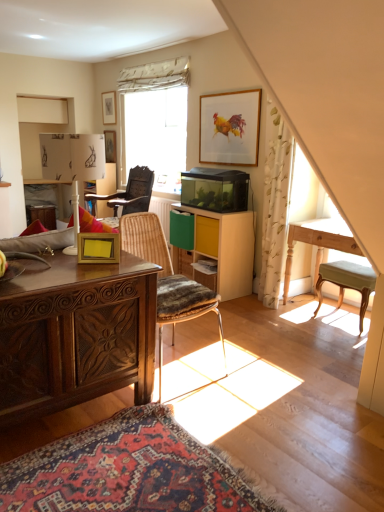
The image size is (384, 512). Describe the element at coordinates (109, 106) in the screenshot. I see `matte gold picture frame at upper center, arranged as the 3th picture frame when viewed from the right` at that location.

Describe the element at coordinates (230, 128) in the screenshot. I see `wooden picture frame at upper center, which appears as the 3th picture frame when viewed from the back` at that location.

This screenshot has height=512, width=384. What do you see at coordinates (347, 283) in the screenshot?
I see `green fabric stool at right, the 1th chair when ordered from right to left` at bounding box center [347, 283].

This screenshot has height=512, width=384. Find the location of `yellow matte cabinet at center`. yellow matte cabinet at center is located at coordinates (225, 248).

This screenshot has height=512, width=384. Describe the element at coordinates (129, 193) in the screenshot. I see `wooden armchair at center, the 3th chair positioned from the right` at that location.

Locate an element on the screen. Image resolution: width=384 pixels, height=512 pixels. polished wood desk at left is located at coordinates (76, 334).

In the scene shown: Which point is more distant from viewer, (x=112, y=143) or (x=179, y=294)?

The point (x=112, y=143) is farther.

Can you tell me how much wooden picture frame at upper center, which ranks as the first picture frame in left-to-right order, and rustic wood chair at center, arranged as the 3th chair when viewed from the back, differ in facing direction?

87.1 degrees separate the facing orientations of wooden picture frame at upper center, which ranks as the first picture frame in left-to-right order, and rustic wood chair at center, arranged as the 3th chair when viewed from the back.

Would you say wooden picture frame at upper center, which ranks as the first picture frame in left-to-right order, is to the left or to the right of rustic wood chair at center, marked as the 1th chair in a front-to-back arrangement, in the picture?

wooden picture frame at upper center, which ranks as the first picture frame in left-to-right order, is positioned on rustic wood chair at center, marked as the 1th chair in a front-to-back arrangement,'s left side.

Considering the sizes of wooden picture frame at upper center, the 1th picture frame from the back, and rustic wood chair at center, arranged as the 3th chair when viewed from the back, in the image, is wooden picture frame at upper center, the 1th picture frame from the back, wider or thinner than rustic wood chair at center, arranged as the 3th chair when viewed from the back,?

wooden picture frame at upper center, the 1th picture frame from the back, is thinner than rustic wood chair at center, arranged as the 3th chair when viewed from the back.

How distant is light wood table at right from wooden photo frame at center, which is the 4th picture frame in back-to-front order?

A distance of 1.80 meters exists between light wood table at right and wooden photo frame at center, which is the 4th picture frame in back-to-front order.

Is light wood table at right not within wooden photo frame at center, which is the third picture frame from left to right?

Yes, light wood table at right is not within wooden photo frame at center, which is the third picture frame from left to right.

Between light wood table at right and wooden photo frame at center, which is the third picture frame from left to right, which one has smaller width?

wooden photo frame at center, which is the third picture frame from left to right, is thinner.

Could you tell me if light wood table at right is facing wooden photo frame at center, which is counted as the 1th picture frame, starting from the bottom?

Yes, light wood table at right is facing wooden photo frame at center, which is counted as the 1th picture frame, starting from the bottom.

Is wooden photo frame at center, the 1th picture frame in the front-to-back sequence, facing away from rustic wood chair at center, arranged as the 3th chair when viewed from the back?

No, rustic wood chair at center, arranged as the 3th chair when viewed from the back, is not at the back of wooden photo frame at center, the 1th picture frame in the front-to-back sequence.

Which object is wider, wooden photo frame at center, which is counted as the 4th picture frame, starting from the top, or rustic wood chair at center, marked as the 1th chair in a front-to-back arrangement?

rustic wood chair at center, marked as the 1th chair in a front-to-back arrangement, is wider.

Between wooden photo frame at center, which is counted as the 4th picture frame, starting from the top, and rustic wood chair at center, the 2th chair viewed from the left, which one has smaller size?

With smaller size is wooden photo frame at center, which is counted as the 4th picture frame, starting from the top.

How much distance is there between wooden photo frame at center, the 2th picture frame when ordered from right to left, and rustic wood chair at center, the 2th chair viewed from the left?

wooden photo frame at center, the 2th picture frame when ordered from right to left, is 16.38 inches away from rustic wood chair at center, the 2th chair viewed from the left.

Is there a large distance between green fabric stool at right, the 2th chair when ordered from front to back, and wooden armchair at center, the first chair from the back?

Yes, green fabric stool at right, the 2th chair when ordered from front to back, and wooden armchair at center, the first chair from the back, are located far from each other.

Does green fabric stool at right, the 2th chair when ordered from front to back, have a lesser width compared to wooden armchair at center, the 3th chair positioned from the right?

Correct, the width of green fabric stool at right, the 2th chair when ordered from front to back, is less than that of wooden armchair at center, the 3th chair positioned from the right.

Looking at this image, can you tell me how much green fabric stool at right, the 1th chair when ordered from right to left, and wooden armchair at center, the third chair positioned from the front, differ in facing direction?

The angular difference between green fabric stool at right, the 1th chair when ordered from right to left, and wooden armchair at center, the third chair positioned from the front, is 1.63 degrees.

From the image's perspective, which is below, green fabric stool at right, the 2th chair from the back, or wooden armchair at center, the third chair positioned from the front?

From the image's view, green fabric stool at right, the 2th chair from the back, is below.

From a real-world perspective, relative to polished wood desk at left, is yellow matte drawer at center vertically above or below?

yellow matte drawer at center is above polished wood desk at left.

Between yellow matte drawer at center and polished wood desk at left, which one has larger size?

polished wood desk at left is bigger.

What's the angular difference between yellow matte drawer at center and polished wood desk at left's facing directions?

89.9 degrees.

Could polished wood desk at left be considered to be inside yellow matte drawer at center?

No.

Could you tell me if rustic wood chair at center, the 2th chair viewed from the left, is facing green fabric stool at right, the 2th chair from the back?

No, rustic wood chair at center, the 2th chair viewed from the left, is not facing towards green fabric stool at right, the 2th chair from the back.

Is rustic wood chair at center, arranged as the 3th chair when viewed from the back, to the right of green fabric stool at right, the 1th chair when ordered from right to left, from the viewer's perspective?

No, rustic wood chair at center, arranged as the 3th chair when viewed from the back, is not to the right of green fabric stool at right, the 1th chair when ordered from right to left.

Does rustic wood chair at center, marked as the 1th chair in a front-to-back arrangement, have a lesser height compared to green fabric stool at right, the 1th chair when ordered from right to left?

Incorrect, the height of rustic wood chair at center, marked as the 1th chair in a front-to-back arrangement, does not fall short of that of green fabric stool at right, the 1th chair when ordered from right to left.

Which of these two, rustic wood chair at center, the second chair positioned from the right, or green fabric stool at right, the 1th chair when ordered from right to left, is bigger?

rustic wood chair at center, the second chair positioned from the right, is bigger.

From a real-world perspective, does matte gold picture frame at upper center, which is the 3th picture frame from front to back, sit lower than yellow matte cabinet at center?

No, from a real-world perspective, matte gold picture frame at upper center, which is the 3th picture frame from front to back, is not under yellow matte cabinet at center.

Which point is more forward, (108, 98) or (225, 223)?

The point (225, 223) is in front.

How much distance is there between matte gold picture frame at upper center, which is the 3th picture frame from front to back, and yellow matte cabinet at center?

A distance of 2.58 meters exists between matte gold picture frame at upper center, which is the 3th picture frame from front to back, and yellow matte cabinet at center.

Does matte gold picture frame at upper center, acting as the 2th picture frame starting from the left, come behind yellow matte cabinet at center?

Yes, matte gold picture frame at upper center, acting as the 2th picture frame starting from the left, is further from the camera.

Which picture frame is the 4th one when counting from the back of the rustic wood chair at center, the second chair positioned from the right? Please provide its 2D coordinates.

[(110, 146)]

Where is `table below the wooden photo frame at center, which is counted as the 4th picture frame, starting from the top (from a real-world perspective)`? The image size is (384, 512). table below the wooden photo frame at center, which is counted as the 4th picture frame, starting from the top (from a real-world perspective) is located at coordinates (318, 249).

Considering their positions, is polished wood desk at left positioned closer to yellow matte drawer at center than wooden picture frame at upper center, which is counted as the 3th picture frame, starting from the bottom?

Answer: polished wood desk at left is closer to yellow matte drawer at center.

Which object lies nearer to the anchor point yellow matte cabinet at center, green fabric stool at right, the 1th chair when ordered from right to left, or yellow matte drawer at center?

Based on the image, yellow matte drawer at center appears to be nearer to yellow matte cabinet at center.

When comparing their distances from green fabric stool at right, the 1th chair when ordered from right to left, does light wood table at right or polished wood desk at left seem closer?

light wood table at right.

From the image, which object appears to be nearer to wooden picture frame at upper center, the 1th picture frame from the back, rustic wood chair at center, marked as the 1th chair in a front-to-back arrangement, or polished wood desk at left?

rustic wood chair at center, marked as the 1th chair in a front-to-back arrangement, is closer to wooden picture frame at upper center, the 1th picture frame from the back.

Looking at the image, which one is located further to yellow matte drawer at center, wooden picture frame at upper center, which ranks as the first picture frame in left-to-right order, or wooden armchair at center, the first chair viewed from the left?

Based on the image, wooden picture frame at upper center, which ranks as the first picture frame in left-to-right order, appears to be further to yellow matte drawer at center.

Which object lies further to the anchor point green fabric stool at right, positioned as the 3th chair in left-to-right order, yellow matte drawer at center or light wood table at right?

Based on the image, yellow matte drawer at center appears to be further to green fabric stool at right, positioned as the 3th chair in left-to-right order.

Looking at this image, based on their spatial positions, is yellow matte cabinet at center or light wood table at right further from yellow matte drawer at center?

Based on the image, light wood table at right appears to be further to yellow matte drawer at center.

Which object lies further to the anchor point rustic wood chair at center, the second chair positioned from the right, light wood table at right or yellow matte drawer at center?

light wood table at right is positioned further to the anchor rustic wood chair at center, the second chair positioned from the right.

This screenshot has height=512, width=384. Find the location of `drawer positioned between green fabric stool at right, positioned as the 3th chair in left-to-right order, and wooden picture frame at upper center, the 1th picture frame from the back, from near to far`. drawer positioned between green fabric stool at right, positioned as the 3th chair in left-to-right order, and wooden picture frame at upper center, the 1th picture frame from the back, from near to far is located at coordinates (207, 236).

The width and height of the screenshot is (384, 512). I want to click on drawer between yellow matte cabinet at center and wooden picture frame at upper center, arranged as the 4th picture frame when viewed from the right, in the front-back direction, so click(x=207, y=236).

This screenshot has width=384, height=512. In order to click on picture frame between green fabric stool at right, positioned as the 3th chair in left-to-right order, and matte gold picture frame at upper center, the fourth picture frame in the bottom-to-top sequence, from front to back in this screenshot , I will do `click(230, 128)`.

In order to click on cabinetry located between wooden armchair at center, the first chair from the back, and light wood table at right in the left-right direction in this screenshot , I will do `click(225, 248)`.